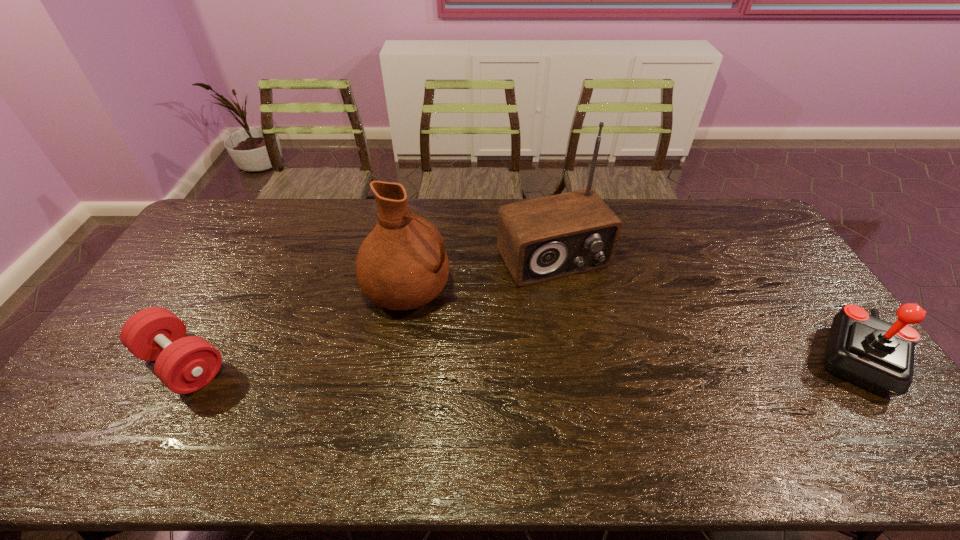
Locate an element on the screen. blank space that satisfies the following two spatial constraints: 1. on the back side of the third shortest object; 2. on the left side of the second object from right to left is located at coordinates (412, 258).

I want to click on free point that satisfies the following two spatial constraints: 1. on the back side of the radio receiver; 2. on the right side of the pitcher, so click(412, 258).

You are a GUI agent. You are given a task and a screenshot of the screen. Output one action in this format:
    pyautogui.click(x=<x>, y=<y>)
    Task: Click on the vacant area in the image that satisfies the following two spatial constraints: 1. on the front side of the radio receiver; 2. on the right side of the rightmost object
    The height and width of the screenshot is (540, 960).
    Given the screenshot: What is the action you would take?
    pyautogui.click(x=570, y=358)